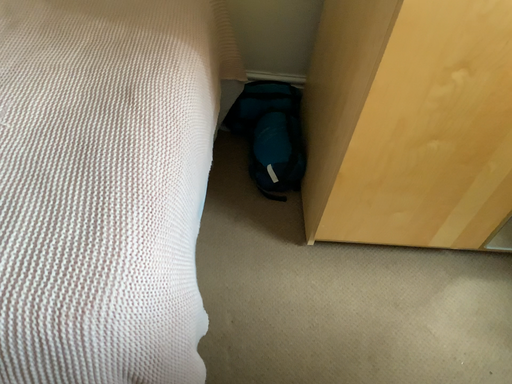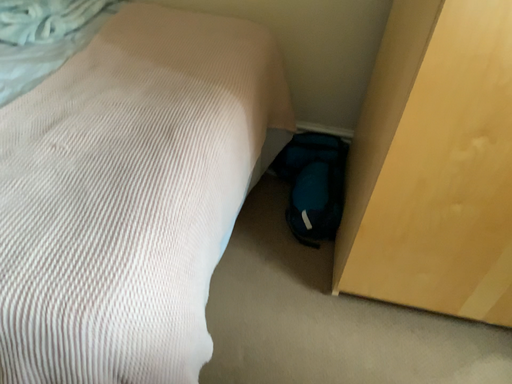
Question: How did the camera likely rotate when shooting the video?

Choices:
 (A) rotated left
 (B) rotated right

Answer: (A)